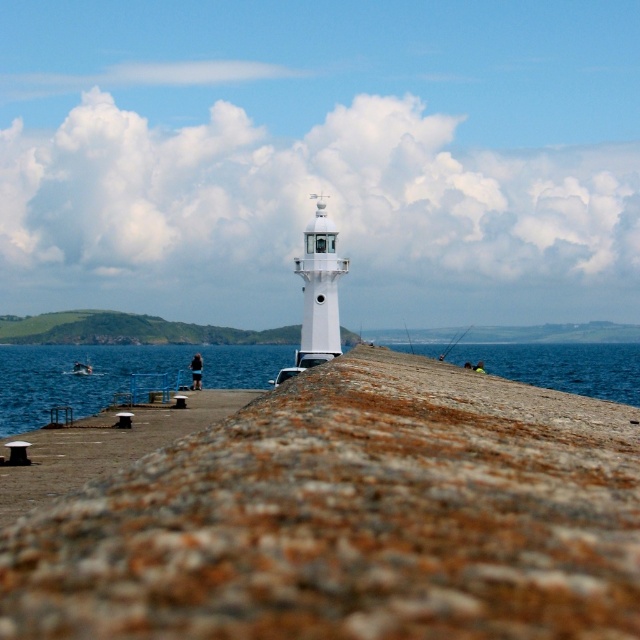
Question: Can you confirm if blue water at lower right is bigger than white plastic boat at center?

Choices:
 (A) yes
 (B) no

Answer: (A)

Question: Is blue water at lower right positioned before white plastic boat at center?

Choices:
 (A) no
 (B) yes

Answer: (B)

Question: Can you confirm if rusty concrete pier at center is positioned to the left of blue water at lower right?

Choices:
 (A) no
 (B) yes

Answer: (B)

Question: Which object is positioned farthest from the blue water at lower right?

Choices:
 (A) rusty concrete pier at center
 (B) white plastic boat at center

Answer: (A)

Question: Which is nearer to the rusty concrete pier at center?

Choices:
 (A) white plastic boat at center
 (B) blue water at lower right

Answer: (B)

Question: Which point appears farthest from the camera in this image?

Choices:
 (A) (77, 369)
 (B) (621, 566)

Answer: (A)